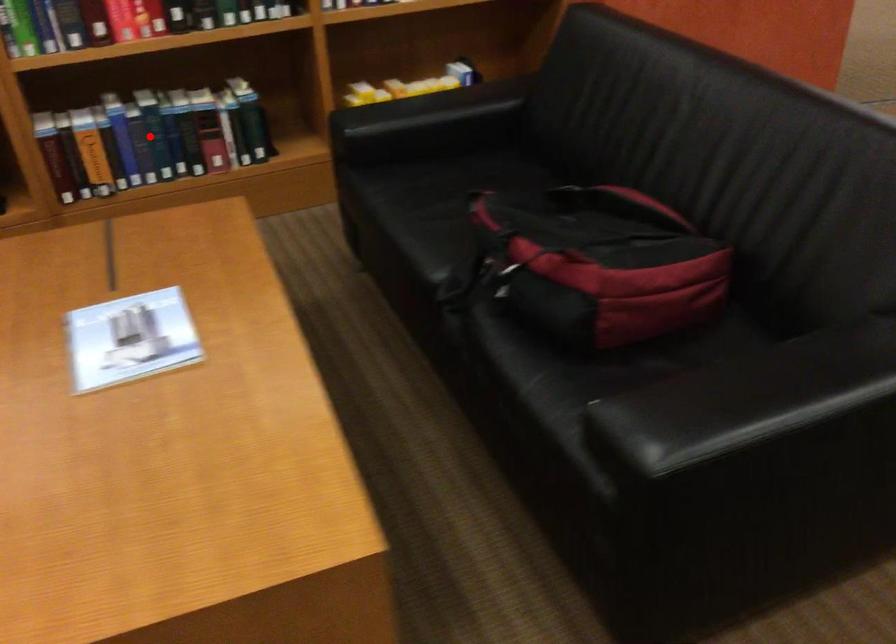
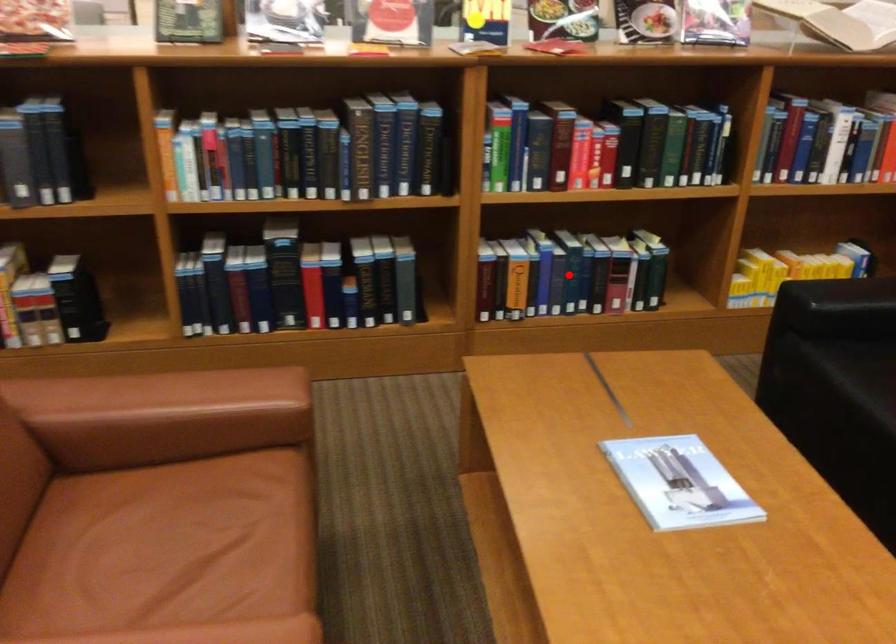
I am providing you with two images of the same scene from different viewpoints. A red point is marked on the first image and another point is marked on the second image. Are the points marked in image1 and image2 representing the same 3D position?

Yes